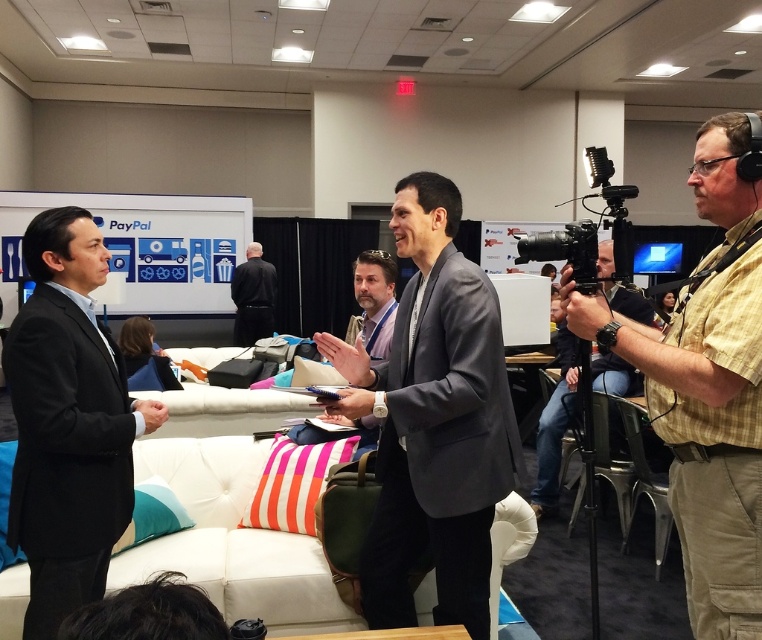
You are a photographer at the event and need to position your matte black camera at right so it doesn t block the view of the black fabric shirt at center. Based on their sizes, is the camera taller than the shirt?

Yes, the matte black camera at right is taller than the black fabric shirt at center, so positioning it carefully would be necessary to avoid blocking the view.

From the picture: You are organizing a photo shoot and need to ensure proper spacing between two gray suits in the image. The gray fabric suit at center and the gray suit at center must be positioned at least 40 centimeters apart for the shot. Based on the scene description, will their current distance meet this requirement?

The gray fabric suit at center is 36.47 centimeters away from the gray suit at center, which is less than the required 40 centimeters. Therefore, their current distance does not meet the spacing requirement for the photo shoot.